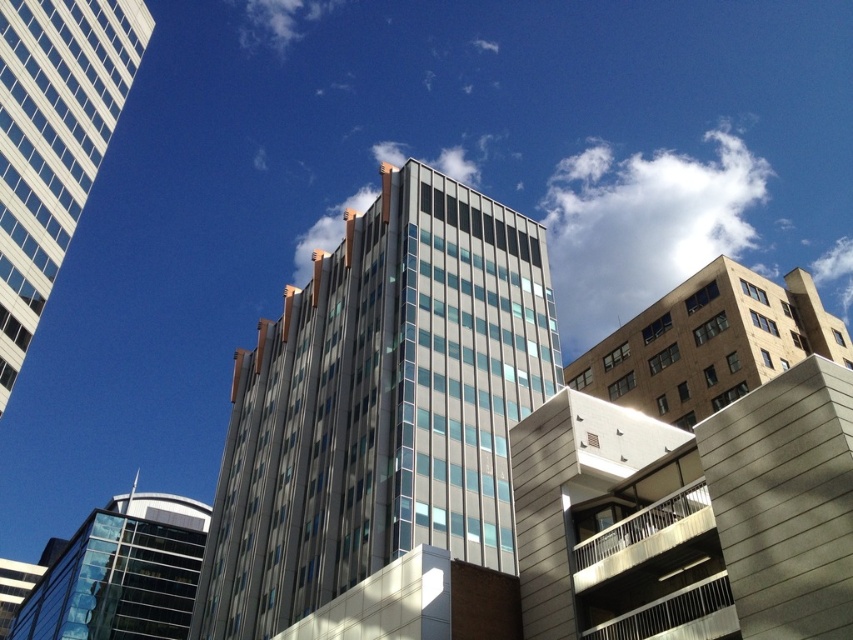
Question: Is metallic glass building at center positioned behind white glass building at upper left?

Choices:
 (A) yes
 (B) no

Answer: (B)

Question: Among these points, which one is nearest to the camera?

Choices:
 (A) (55, 161)
 (B) (427, 365)

Answer: (B)

Question: Which object appears farthest from the camera in this image?

Choices:
 (A) metallic glass building at center
 (B) white glass building at upper left

Answer: (B)

Question: Is metallic glass building at center above white glass building at upper left?

Choices:
 (A) no
 (B) yes

Answer: (A)

Question: In this image, where is metallic glass building at center located relative to white glass building at upper left?

Choices:
 (A) below
 (B) above

Answer: (A)